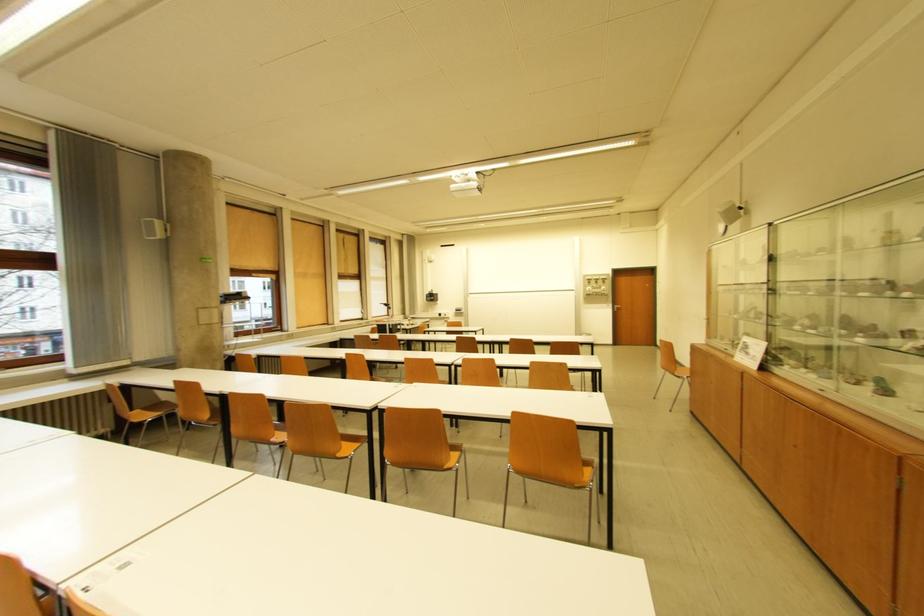
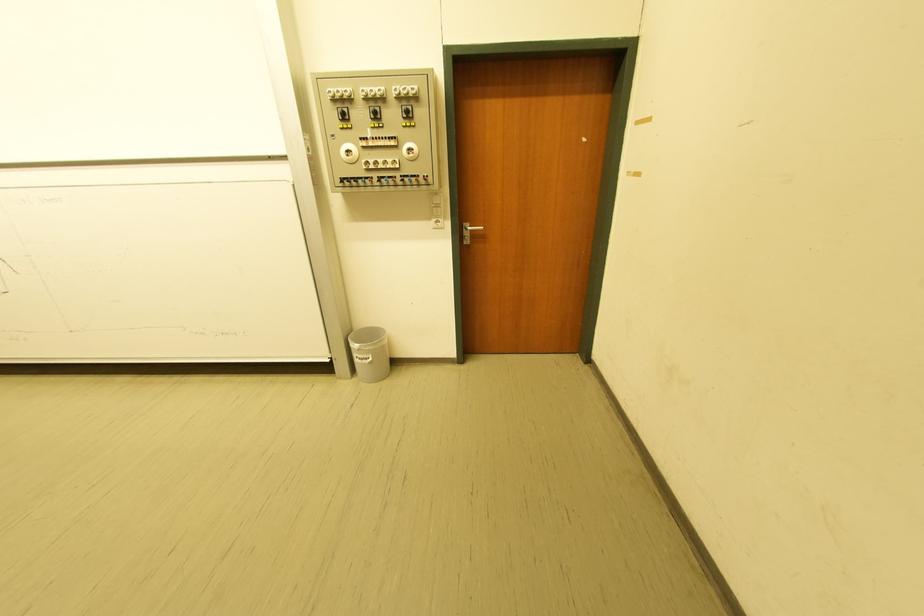
Locate, in the second image, the point that corresponds to pixel 593 284 in the first image.

(342, 116)